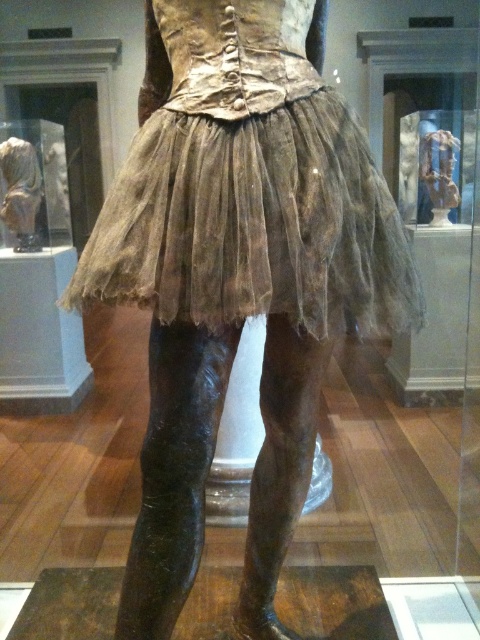
This screenshot has height=640, width=480. What do you see at coordinates (253, 225) in the screenshot? I see `brown sheer tulle skirt at center` at bounding box center [253, 225].

Can you confirm if brown sheer tulle skirt at center is positioned to the right of matte bronze statue at center?

Indeed, brown sheer tulle skirt at center is positioned on the right side of matte bronze statue at center.

Which is in front, point (204, 260) or point (38, 193)?

Point (204, 260)

Where is `brown sheer tulle skirt at center`? The width and height of the screenshot is (480, 640). brown sheer tulle skirt at center is located at coordinates (253, 225).

Who is taller, brown sheer tulle skirt at center or matte bronze statue at upper right?

Standing taller between the two is matte bronze statue at upper right.

Between point (408, 289) and point (455, 173), which one is positioned in front?

Point (408, 289) is in front.

Identify the location of brown sheer tulle skirt at center. coord(253,225).

This screenshot has width=480, height=640. Find the location of `brown sheer tulle skirt at center`. brown sheer tulle skirt at center is located at coordinates (253, 225).

Measure the distance from matte bronze statue at center to matte bronze statue at upper right.

matte bronze statue at center and matte bronze statue at upper right are 2.49 meters apart from each other.

Who is positioned more to the right, matte bronze statue at center or matte bronze statue at upper right?

From the viewer's perspective, matte bronze statue at upper right appears more on the right side.

What do you see at coordinates (21, 193) in the screenshot? I see `matte bronze statue at center` at bounding box center [21, 193].

You are a GUI agent. You are given a task and a screenshot of the screen. Output one action in this format:
    pyautogui.click(x=<x>, y=<y>)
    Task: Click on the matte bronze statue at center
    The height and width of the screenshot is (640, 480).
    Given the screenshot: What is the action you would take?
    pyautogui.click(x=21, y=193)